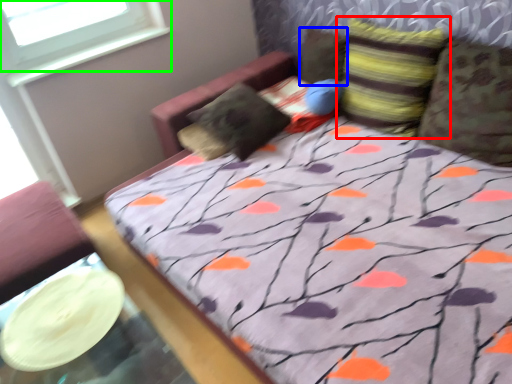
Question: Which is nearer to the pillow (highlighted by a red box)? pillow (highlighted by a blue box) or window (highlighted by a green box).

Choices:
 (A) pillow
 (B) window

Answer: (A)